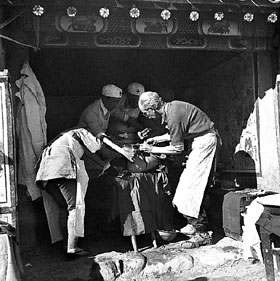
Image resolution: width=280 pixels, height=281 pixels. What are the coordinates of `decorations` in the screenshot? It's located at (152, 24), (211, 24), (85, 23).